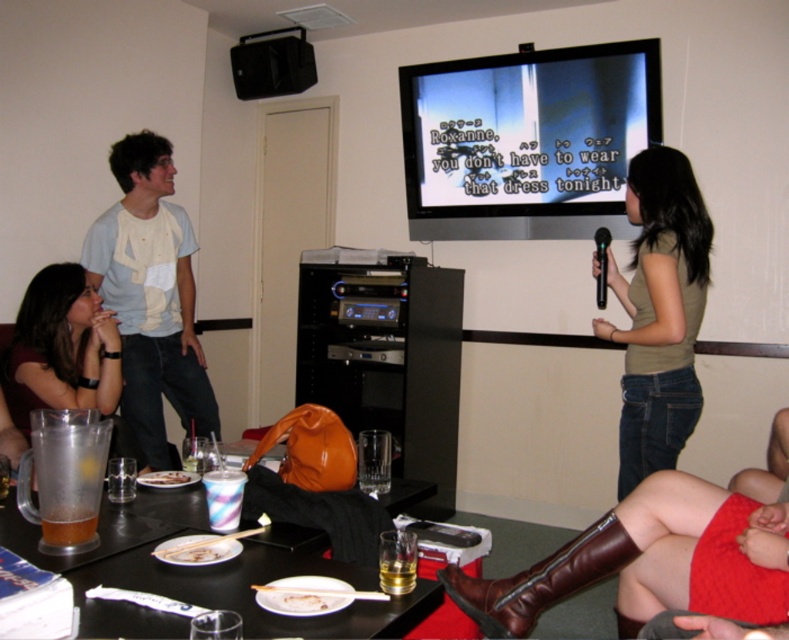
Question: Can you confirm if white cotton shirt at upper left is positioned above translucent plastic pitcher at table left?

Choices:
 (A) no
 (B) yes

Answer: (B)

Question: Does translucent plastic cups at lower center appear under translucent glass beverage at lower center?

Choices:
 (A) no
 (B) yes

Answer: (B)

Question: Considering the relative positions of translucent plastic pitcher at table left and translucent glass beverage at lower center in the image provided, where is translucent plastic pitcher at table left located with respect to translucent glass beverage at lower center?

Choices:
 (A) below
 (B) above

Answer: (B)

Question: Which point is farther to the camera?

Choices:
 (A) matte green tank top at center
 (B) orange leather entertainment center at center

Answer: (B)

Question: Which point is farther to the camera?

Choices:
 (A) (406, 557)
 (B) (96, 333)
 (C) (601, 232)

Answer: (C)

Question: Which point is farther from the camera taking this photo?

Choices:
 (A) (404, 419)
 (B) (395, 497)
 (C) (152, 461)

Answer: (A)